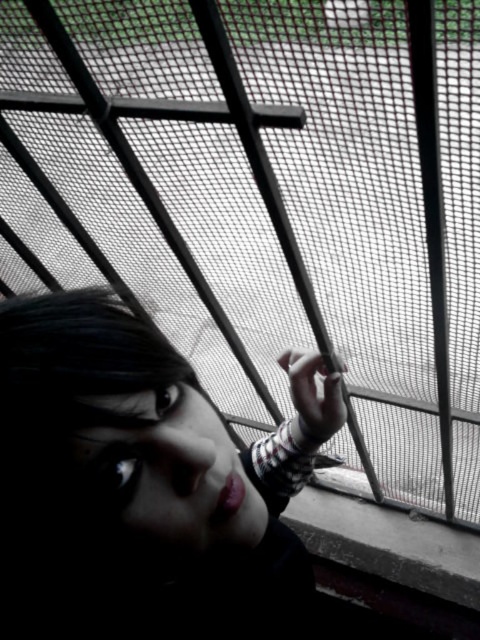
Between matte black hair at center and matte skin face at lower left, which one appears on the right side from the viewer's perspective?

From the viewer's perspective, matte black hair at center appears more on the right side.

The image size is (480, 640). What are the coordinates of `matte black hair at center` in the screenshot? It's located at (143, 484).

Is point (251, 577) in front of point (214, 456)?

That is False.

Locate an element on the screen. The image size is (480, 640). matte black hair at center is located at coordinates (143, 484).